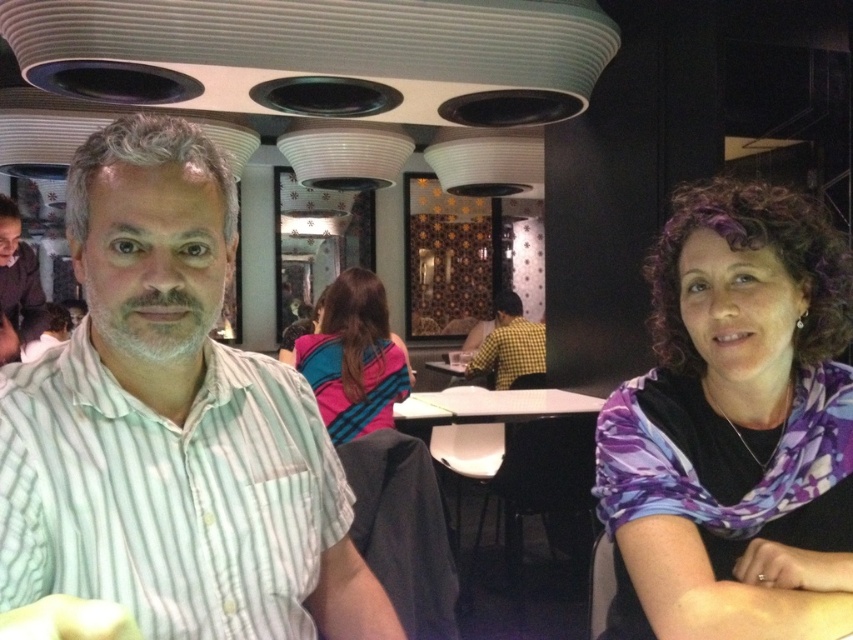
Question: Is light green striped shirt at left wider than white glossy table at center?

Choices:
 (A) no
 (B) yes

Answer: (A)

Question: Is purple printed scarf at right below checkered fabric shirt at center?

Choices:
 (A) yes
 (B) no

Answer: (B)

Question: Estimate the real-world distances between objects in this image. Which object is farther from the blue striped scarf at center?

Choices:
 (A) white glossy table at center
 (B) matte black shirt at left
 (C) checkered fabric shirt at center
 (D) light green striped shirt at left

Answer: (C)

Question: Considering the real-world distances, which object is closest to the purple printed scarf at right?

Choices:
 (A) matte black shirt at left
 (B) light green striped shirt at left

Answer: (B)

Question: Which point is closer to the camera?

Choices:
 (A) purple printed scarf at right
 (B) white glossy table at center
 (C) blue striped scarf at center

Answer: (A)

Question: Does light green striped shirt at left come behind matte black shirt at left?

Choices:
 (A) yes
 (B) no

Answer: (B)